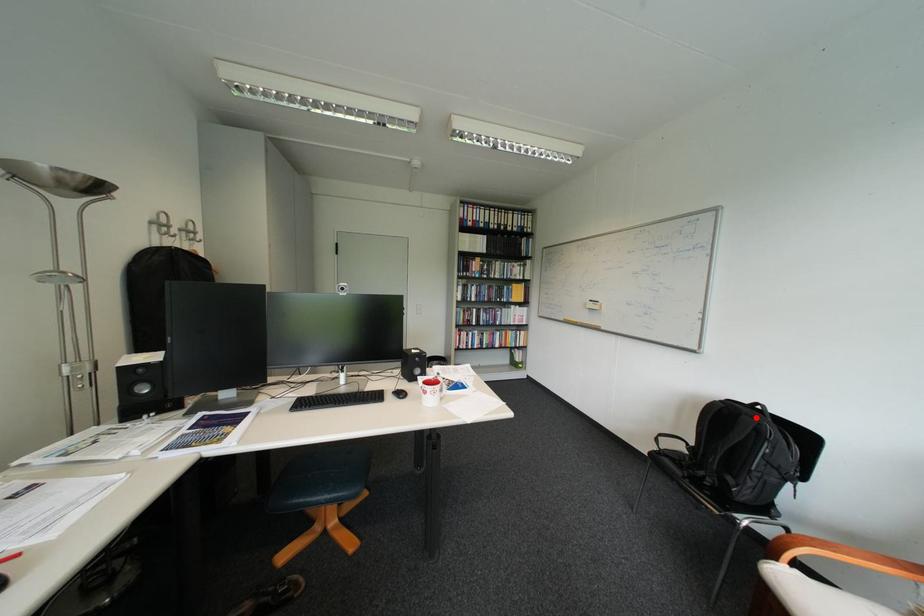
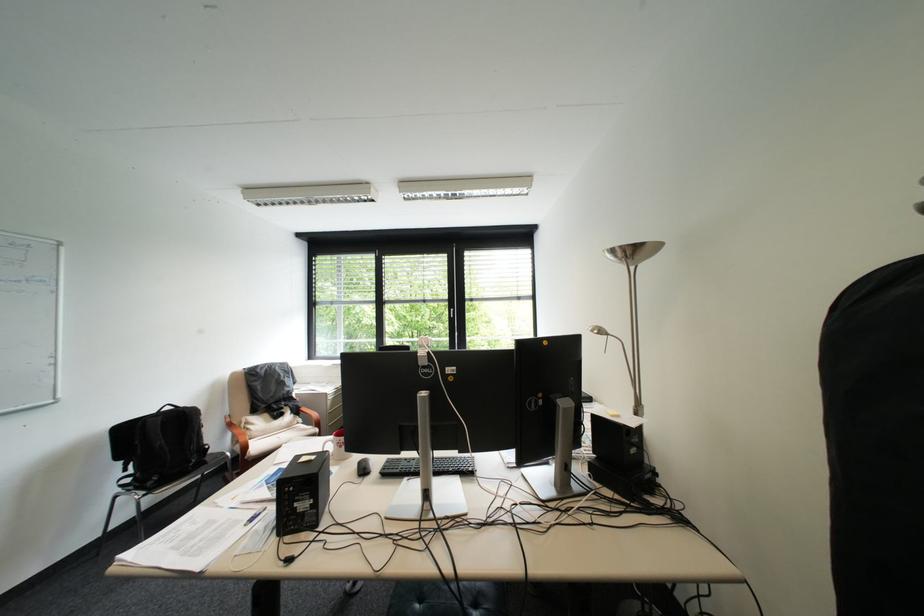
The point at the highlighted location is marked in the first image. Where is the corresponding point in the second image?

(198, 411)